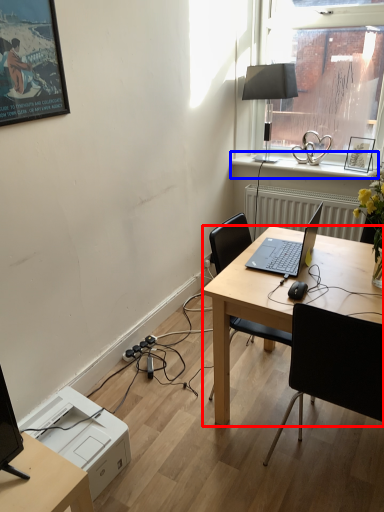
Question: Among these objects, which one is nearest to the camera, desk (highlighted by a red box) or window sill (highlighted by a blue box)?

Choices:
 (A) desk
 (B) window sill

Answer: (A)